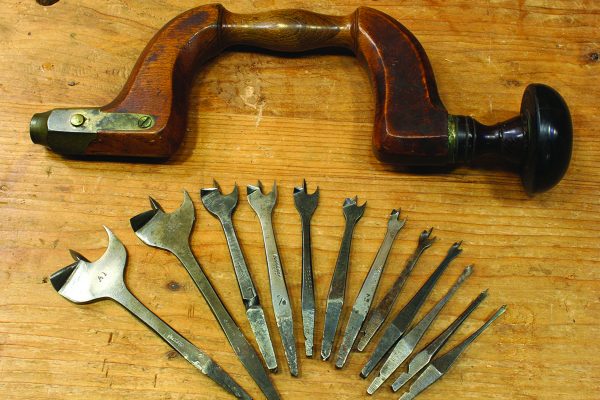
Where is `handle`? The image size is (600, 400). handle is located at coordinates (263, 32).